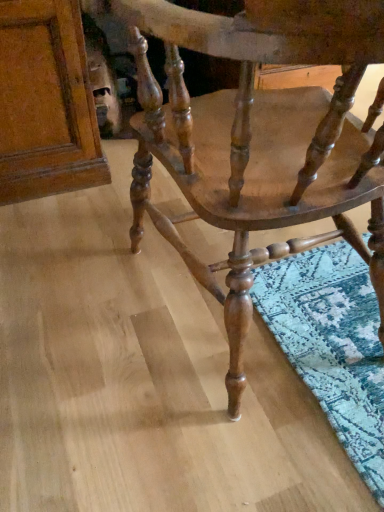
Describe the element at coordinates (259, 139) in the screenshot. I see `wooden chair at center` at that location.

What is the approximate width of wooden chair at center?

wooden chair at center is 25.62 inches in width.

The height and width of the screenshot is (512, 384). Identify the location of wooden chair at center. (259, 139).

Image resolution: width=384 pixels, height=512 pixels. Find the location of `matte wood cabinet at upper left`. matte wood cabinet at upper left is located at coordinates (46, 103).

Describe the element at coordinates (46, 103) in the screenshot. This screenshot has height=512, width=384. I see `matte wood cabinet at upper left` at that location.

You are a GUI agent. You are given a task and a screenshot of the screen. Output one action in this format:
    pyautogui.click(x=<x>, y=<y>)
    Task: Click on the wooden chair at center
    The image size is (384, 512).
    Given the screenshot: What is the action you would take?
    pyautogui.click(x=259, y=139)

Would you say matte wood cabinet at upper left is to the left or to the right of wooden chair at center in the picture?

matte wood cabinet at upper left is positioned on wooden chair at center's left side.

Is matte wood cabinet at upper left positioned in front of wooden chair at center?

No, the depth of matte wood cabinet at upper left is greater than that of wooden chair at center.

Is point (29, 134) more distant than point (371, 246)?

Yes, it is.

From the image's perspective, is matte wood cabinet at upper left under wooden chair at center?

Actually, matte wood cabinet at upper left appears above wooden chair at center in the image.

From a real-world perspective, is matte wood cabinet at upper left below wooden chair at center?

Yes, from a real-world perspective, matte wood cabinet at upper left is beneath wooden chair at center.

Does matte wood cabinet at upper left have a greater width compared to wooden chair at center?

Indeed, matte wood cabinet at upper left has a greater width compared to wooden chair at center.

Between matte wood cabinet at upper left and wooden chair at center, which one has more height?

With more height is wooden chair at center.

Considering the sizes of matte wood cabinet at upper left and wooden chair at center in the image, is matte wood cabinet at upper left bigger or smaller than wooden chair at center?

Clearly, matte wood cabinet at upper left is smaller in size than wooden chair at center.

Would you say matte wood cabinet at upper left contains wooden chair at center?

No, wooden chair at center is not inside matte wood cabinet at upper left.

Is matte wood cabinet at upper left positioned far away from wooden chair at center?

No, matte wood cabinet at upper left is not far away from wooden chair at center.

Is matte wood cabinet at upper left turned away from wooden chair at center?

matte wood cabinet at upper left is not turned away from wooden chair at center.

How different are the orientations of matte wood cabinet at upper left and wooden chair at center in degrees?

The angular difference between matte wood cabinet at upper left and wooden chair at center is 179 degrees.

Where is `plank above the wooden chair at center (from the image's perspective)`? plank above the wooden chair at center (from the image's perspective) is located at coordinates (46, 103).

Based on their positions, is wooden chair at center located to the left or right of matte wood cabinet at upper left?

wooden chair at center is to the right of matte wood cabinet at upper left.

Is the position of wooden chair at center less distant than that of matte wood cabinet at upper left?

Yes, the depth of wooden chair at center is less than that of matte wood cabinet at upper left.

Does point (181, 81) come behind point (24, 152)?

No, (181, 81) is closer to viewer.

From the image's perspective, between wooden chair at center and matte wood cabinet at upper left, who is located below?

wooden chair at center, from the image's perspective.

From a real-world perspective, which object rests below the other?

matte wood cabinet at upper left is physically lower.

Looking at their sizes, would you say wooden chair at center is wider or thinner than matte wood cabinet at upper left?

wooden chair at center is thinner than matte wood cabinet at upper left.

Which of these two, wooden chair at center or matte wood cabinet at upper left, stands taller?

Standing taller between the two is wooden chair at center.

Based on the photo, which of these two, wooden chair at center or matte wood cabinet at upper left, is bigger?

wooden chair at center is bigger.

Can we say wooden chair at center lies outside matte wood cabinet at upper left?

That's correct, wooden chair at center is outside of matte wood cabinet at upper left.

Are wooden chair at center and matte wood cabinet at upper left making contact?

They are not placed beside each other.

Could you tell me if wooden chair at center is turned towards matte wood cabinet at upper left?

Yes, wooden chair at center is turned towards matte wood cabinet at upper left.

How many degrees apart are the facing directions of wooden chair at center and matte wood cabinet at upper left?

They differ by 179 degrees in their facing directions.

Where is `plank above the wooden chair at center (from the image's perspective)`? The width and height of the screenshot is (384, 512). plank above the wooden chair at center (from the image's perspective) is located at coordinates (46, 103).

The height and width of the screenshot is (512, 384). What are the coordinates of `plank on the left of wooden chair at center` in the screenshot? It's located at (46, 103).

The height and width of the screenshot is (512, 384). Identify the location of chair lying below the matte wood cabinet at upper left (from the image's perspective). click(x=259, y=139).